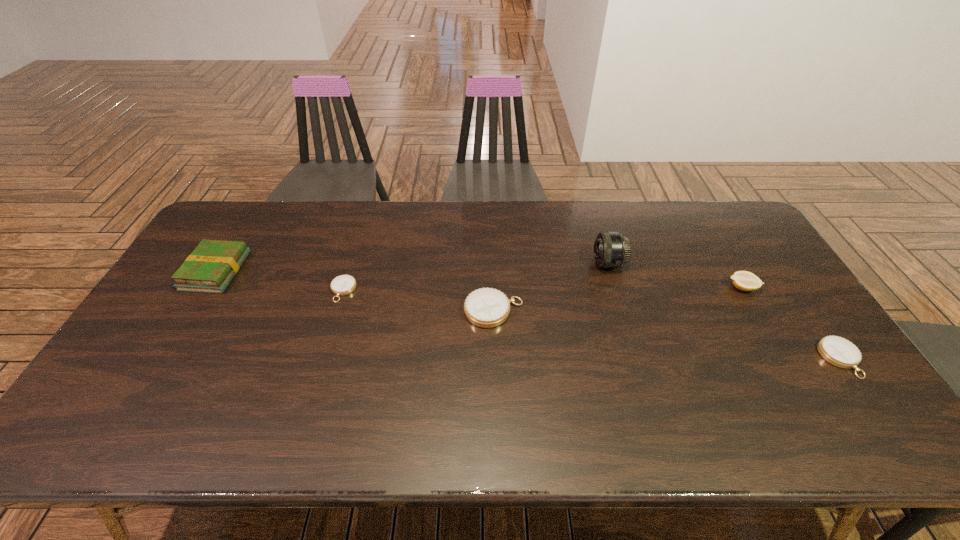
Where is `the shortest compass`? This screenshot has width=960, height=540. the shortest compass is located at coordinates (342, 285).

Find the location of a particular element. the shortest object is located at coordinates (342, 285).

I want to click on the fourth tallest object, so click(486, 307).

Find the location of a particular element. the fourth object from right to left is located at coordinates (486, 307).

Where is `the second tallest compass`? The image size is (960, 540). the second tallest compass is located at coordinates (838, 351).

I want to click on the nearest object, so click(x=838, y=351).

Where is `book`? The width and height of the screenshot is (960, 540). book is located at coordinates (210, 268).

Identify the location of the fifth shortest object. (210, 268).

This screenshot has width=960, height=540. I want to click on lemon, so click(743, 280).

Find the location of a particular element. the fifth object from left to right is located at coordinates (743, 280).